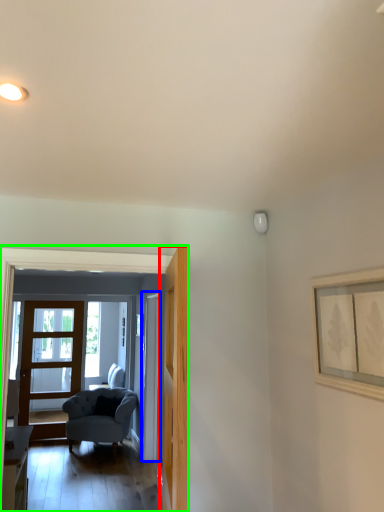
Question: Estimate the real-world distances between objects in this image. Which object is farther from door (highlighted by a red box), door (highlighted by a blue box) or residence (highlighted by a green box)?

Choices:
 (A) door
 (B) residence

Answer: (A)